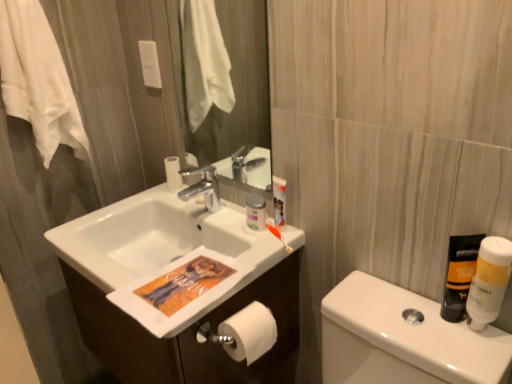
Question: In terms of size, does white matte bottle at right, arranged as the 2th mouthwash when viewed from the left, appear bigger or smaller than translucent plastic bottle at right, which appears as the 2th mouthwash when viewed from the right?

Choices:
 (A) small
 (B) big

Answer: (B)

Question: From a real-world perspective, is white matte bottle at right, which is counted as the first mouthwash, starting from the right, above or below translucent plastic bottle at right, which appears as the 2th mouthwash when viewed from the right?

Choices:
 (A) above
 (B) below

Answer: (A)

Question: Considering the real-world distances, which object is closest to the white glossy sink at center?

Choices:
 (A) white matte toilet paper at lower center
 (B) white cotton towel at upper left
 (C) translucent plastic bottle at right, the first mouthwash when ordered from left to right
 (D) white matte bottle at right, which is counted as the first mouthwash, starting from the right
 (E) white glossy cabinet at center

Answer: (E)

Question: Estimate the real-world distances between objects in this image. Which object is closer to the matte plastic container at upper center?

Choices:
 (A) white cotton towel at upper left
 (B) white matte toilet paper at lower center
 (C) translucent plastic bottle at right, which appears as the 2th mouthwash when viewed from the right
 (D) white matte bottle at right, arranged as the 2th mouthwash when viewed from the left
 (E) white glossy toilet paper at lower left

Answer: (B)